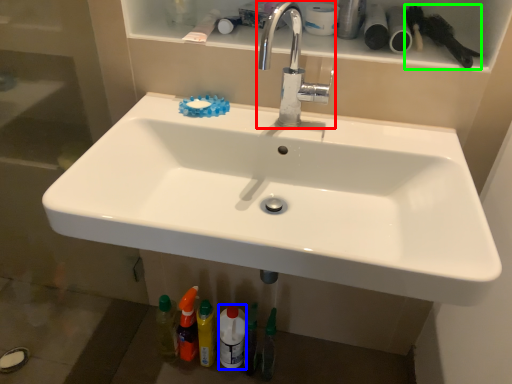
Question: Based on their relative distances, which object is nearer to tap (highlighted by a red box)? Choose from mouthwash (highlighted by a blue box) and brush (highlighted by a green box).

Choices:
 (A) mouthwash
 (B) brush

Answer: (B)